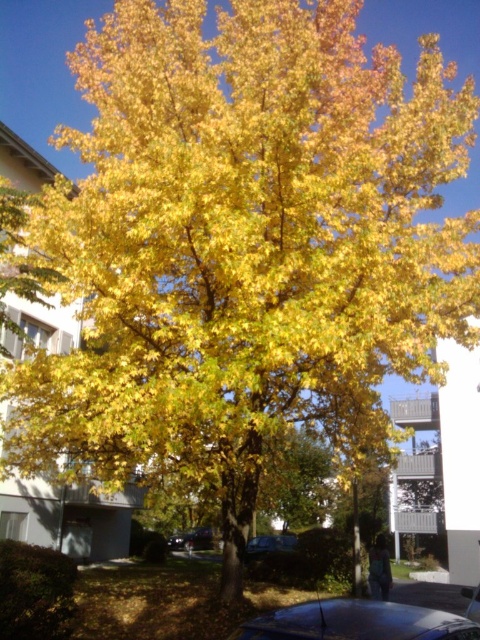
You are standing at the point marked by coordinates point (357, 621) in the image. What object are you standing on?

You are standing on the glossy metallic car at lower center marked by point (357, 621).

You are standing at the entrance of the residential area and see the metallic blue car at center. Based on its position, can you determine if it is parked closer to the tree or the buildings?

The metallic blue car at center is located at point (269, 547), which places it closer to the buildings in the background rather than the tree in the center. Therefore, it is parked nearer to the buildings.

You are a delivery driver who needs to park your vehicle between the glossy metallic car at lower center and the shiny black car at center. The parking spot between them is 3 meters wide. Can your 2.5 meter wide delivery van fit in this space?

The distance between the glossy metallic car at lower center and the shiny black car at center is 29.45 meters. Since the parking spot between them is only 3 meters wide, the 2.5 meter wide delivery van can fit as it is narrower than the available space.